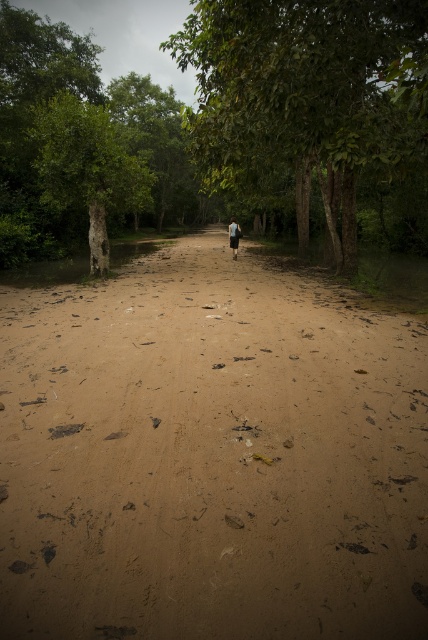
Which is above, brown sandy dirt track at center or green matte tree at left?

green matte tree at left

Which is below, brown sandy dirt track at center or green matte tree at left?

brown sandy dirt track at center is below.

Is point (107, 497) farther from camera compared to point (47, 170)?

No, (107, 497) is closer to viewer.

At what (x,y) coordinates should I click in order to perform the action: click on brown sandy dirt track at center. Please return your answer as a coordinate pair (x, y). This screenshot has width=428, height=640. Looking at the image, I should click on (211, 456).

Can you confirm if green matte tree at left is positioned below dark blue fabric at center?

No, green matte tree at left is not below dark blue fabric at center.

Is point (122, 189) positioned in front of point (238, 227)?

Yes, it is in front of point (238, 227).

Which is in front, point (45, 189) or point (234, 253)?

Positioned in front is point (45, 189).

The width and height of the screenshot is (428, 640). I want to click on green matte tree at left, so click(x=86, y=168).

Who is taller, green leafy tree at center or green matte tree at left?

Standing taller between the two is green leafy tree at center.

Can you confirm if green leafy tree at center is positioned above green matte tree at left?

Yes, green leafy tree at center is above green matte tree at left.

Which is behind, point (342, 49) or point (115, 179)?

The point (115, 179) is more distant.

At what (x,y) coordinates should I click in order to perform the action: click on green leafy tree at center. Please return your answer as a coordinate pair (x, y). Looking at the image, I should click on (306, 97).